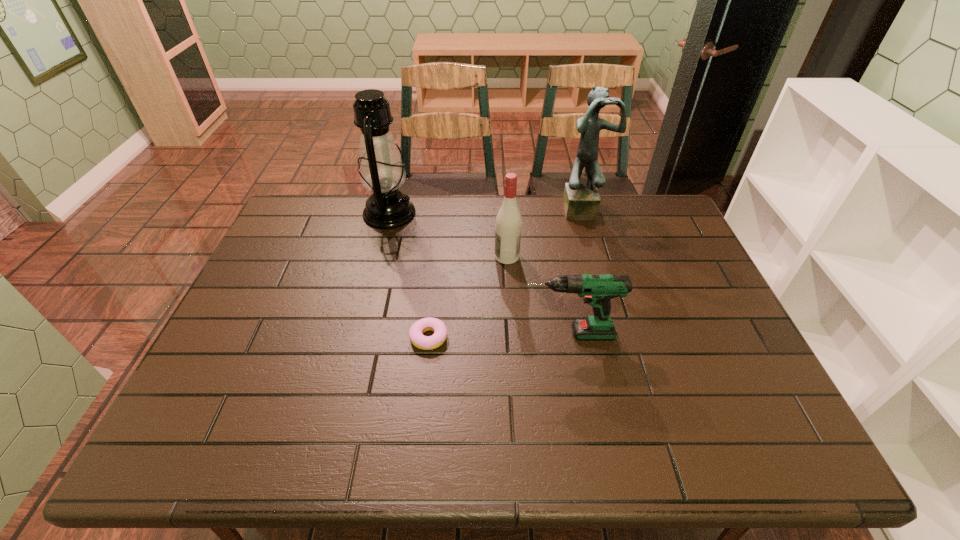
You are a GUI agent. You are given a task and a screenshot of the screen. Output one action in this format:
    pyautogui.click(x=<x>, y=<y>)
    Task: Click on the unoccupied area between the fourth object from right to left and the sculpture
    This screenshot has height=540, width=960.
    Given the screenshot: What is the action you would take?
    pyautogui.click(x=506, y=273)

What are the coordinates of `free space that is in between the sculpture and the oil lamp` in the screenshot? It's located at (486, 211).

At what (x,y) coordinates should I click in order to perform the action: click on vacant space in between the third farthest object and the drill. Please return your answer as a coordinate pair (x, y). The width and height of the screenshot is (960, 540). Looking at the image, I should click on (538, 295).

Where is `vacant region between the sculpture and the doughnut`? The height and width of the screenshot is (540, 960). vacant region between the sculpture and the doughnut is located at coordinates (506, 273).

Select which object is the closest to the fourth tallest object. Please provide its 2D coordinates. Your answer should be formatted as a tuple, i.e. [(x, y)], where the tuple contains the x and y coordinates of a point satisfying the conditions above.

[(416, 331)]

I want to click on object that is the fourth closest one to the drill, so click(x=381, y=169).

Where is `vacant point that satisfies the following two spatial constraints: 1. on the face of the sculpture; 2. on the handle side of the drill`? The height and width of the screenshot is (540, 960). vacant point that satisfies the following two spatial constraints: 1. on the face of the sculpture; 2. on the handle side of the drill is located at coordinates (618, 334).

The image size is (960, 540). Find the location of `vacant space that satisfies the following two spatial constraints: 1. on the handle side of the drill; 2. on the front side of the doughnut`. vacant space that satisfies the following two spatial constraints: 1. on the handle side of the drill; 2. on the front side of the doughnut is located at coordinates (569, 339).

Image resolution: width=960 pixels, height=540 pixels. I want to click on free spot that satisfies the following two spatial constraints: 1. on the face of the sculpture; 2. on the label of the alcohol, so click(x=596, y=256).

Find the location of a particular element. The image size is (960, 540). vacant point that satisfies the following two spatial constraints: 1. on the face of the sculpture; 2. on the handle side of the drill is located at coordinates (618, 334).